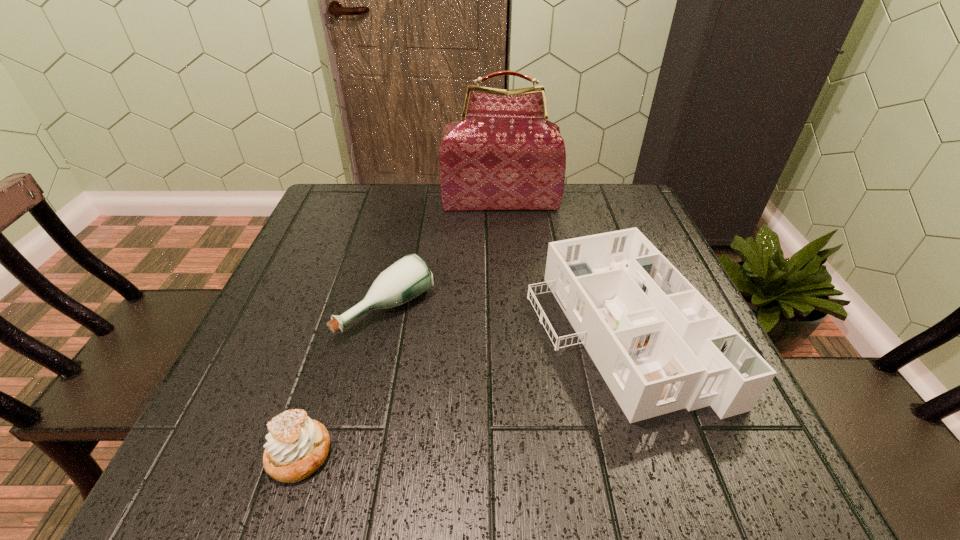
The width and height of the screenshot is (960, 540). Find the location of `blank region between the farthest object and the nearest object`. blank region between the farthest object and the nearest object is located at coordinates (400, 328).

Find the location of a particular element. This screenshot has height=540, width=960. free point between the tallest object and the bottle is located at coordinates (444, 255).

You are a GUI agent. You are given a task and a screenshot of the screen. Output one action in this format:
    pyautogui.click(x=<x>, y=<y>)
    Task: Click on the empty space between the tallest object and the bottle
    The height and width of the screenshot is (540, 960).
    Given the screenshot: What is the action you would take?
    pyautogui.click(x=444, y=255)

Where is `vacant region between the bottle and the dollhouse`? The width and height of the screenshot is (960, 540). vacant region between the bottle and the dollhouse is located at coordinates (503, 319).

Find the location of a particular element. vacant space that is in between the nearest object and the bottle is located at coordinates (344, 381).

This screenshot has height=540, width=960. Identify the location of free space that is in between the pastry and the bottle. (344, 381).

What are the coordinates of `free space between the tallest object and the pastry` in the screenshot? It's located at (400, 328).

In order to click on free space between the pastry and the dollhouse in this screenshot , I will do `click(460, 392)`.

Where is `object that stands as the second closest to the dollhouse`? The height and width of the screenshot is (540, 960). object that stands as the second closest to the dollhouse is located at coordinates (503, 154).

At what (x,y) coordinates should I click in order to perform the action: click on object that is the nearest to the nearest object. Please return your answer as a coordinate pair (x, y). This screenshot has height=540, width=960. Looking at the image, I should click on (407, 278).